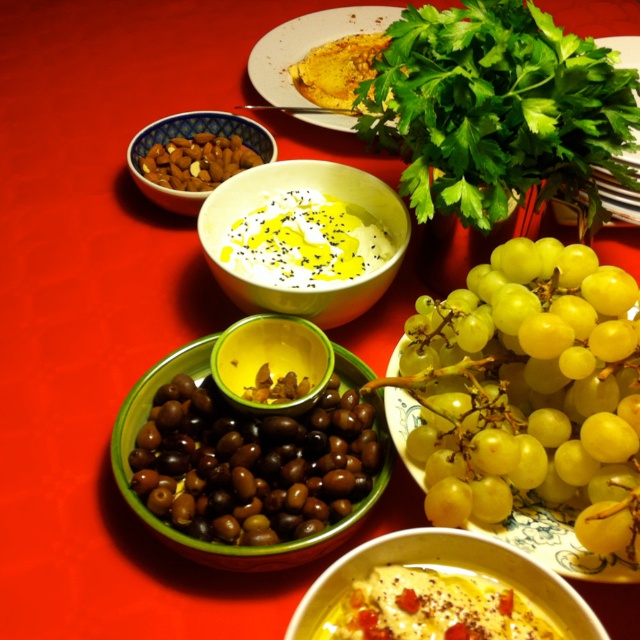
Between matte ceramic bowl at lower center and blue and white ceramic bowl at upper left, which one is positioned lower?

Positioned lower is matte ceramic bowl at lower center.

Which is in front, point (481, 557) or point (145, 136)?

Point (481, 557) is more forward.

Is point (429, 596) positioned behind point (131, 170)?

That is False.

Locate an element on the screen. matte ceramic bowl at lower center is located at coordinates (440, 593).

Who is shorter, matte yellow bowl at center or yellow matte bread at center?

matte yellow bowl at center is shorter.

Is point (332, 364) closer to camera compared to point (310, 81)?

That is True.

Image resolution: width=640 pixels, height=640 pixels. I want to click on matte yellow bowl at center, so click(272, 362).

Can you confirm if green matte grapes at center-right is taller than smooth brown nuts at upper left?

Indeed, green matte grapes at center-right has a greater height compared to smooth brown nuts at upper left.

Is point (609, 320) farther from camera compared to point (177, 170)?

No.

Between point (467, 323) and point (236, 148), which one is positioned in front?

Point (467, 323) is in front.

Identify the location of green matte grapes at center-right. (528, 400).